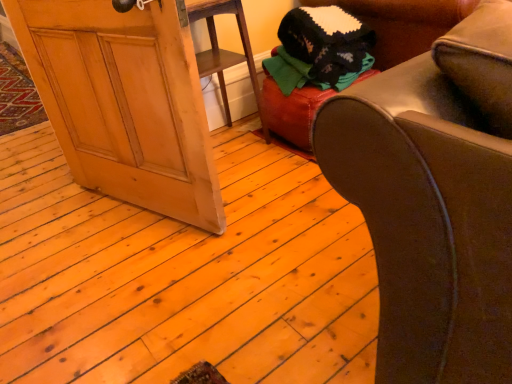
Question: From a real-world perspective, does leather ottoman at center stand above wooden screen door at lower left?

Choices:
 (A) yes
 (B) no

Answer: (B)

Question: Is leather ottoman at center taller than wooden screen door at lower left?

Choices:
 (A) no
 (B) yes

Answer: (A)

Question: Could wooden screen door at lower left be considered to be inside leather ottoman at center?

Choices:
 (A) no
 (B) yes

Answer: (A)

Question: Considering the relative positions of leather ottoman at center and wooden screen door at lower left in the image provided, is leather ottoman at center in front of wooden screen door at lower left?

Choices:
 (A) no
 (B) yes

Answer: (A)

Question: Can you confirm if leather ottoman at center is smaller than wooden screen door at lower left?

Choices:
 (A) yes
 (B) no

Answer: (A)

Question: From a real-world perspective, is wooden screen door at lower left physically located above or below knitted wool sweater at upper right?

Choices:
 (A) above
 (B) below

Answer: (A)

Question: From the image's perspective, is wooden screen door at lower left positioned above or below knitted wool sweater at upper right?

Choices:
 (A) below
 (B) above

Answer: (A)

Question: In the image, is wooden screen door at lower left positioned in front of or behind knitted wool sweater at upper right?

Choices:
 (A) front
 (B) behind

Answer: (A)

Question: In terms of width, does wooden screen door at lower left look wider or thinner when compared to knitted wool sweater at upper right?

Choices:
 (A) thin
 (B) wide

Answer: (A)

Question: From a real-world perspective, is wooden screen door at lower left positioned above or below leather ottoman at center?

Choices:
 (A) above
 (B) below

Answer: (A)

Question: In terms of height, does wooden screen door at lower left look taller or shorter compared to leather ottoman at center?

Choices:
 (A) short
 (B) tall

Answer: (B)

Question: Is wooden screen door at lower left inside the boundaries of leather ottoman at center, or outside?

Choices:
 (A) inside
 (B) outside

Answer: (B)

Question: Relative to leather ottoman at center, is wooden screen door at lower left in front or behind?

Choices:
 (A) front
 (B) behind

Answer: (A)

Question: Relative to wooden screen door at lower left, is knitted wool sweater at upper right in front or behind?

Choices:
 (A) front
 (B) behind

Answer: (B)

Question: From the image's perspective, is knitted wool sweater at upper right located above or below wooden screen door at lower left?

Choices:
 (A) below
 (B) above

Answer: (B)